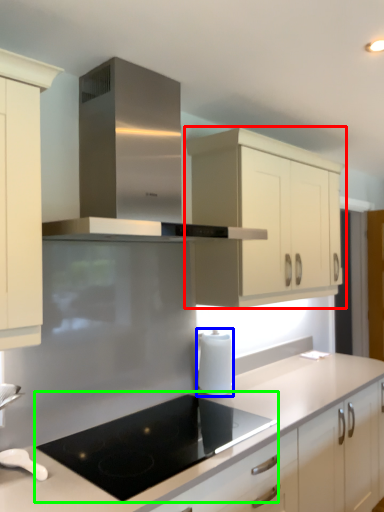
Question: Based on their relative distances, which object is nearer to cabinetry (highlighted by a red box)? Choose from kitchen appliance (highlighted by a blue box) and gas stove (highlighted by a green box).

Choices:
 (A) kitchen appliance
 (B) gas stove

Answer: (A)